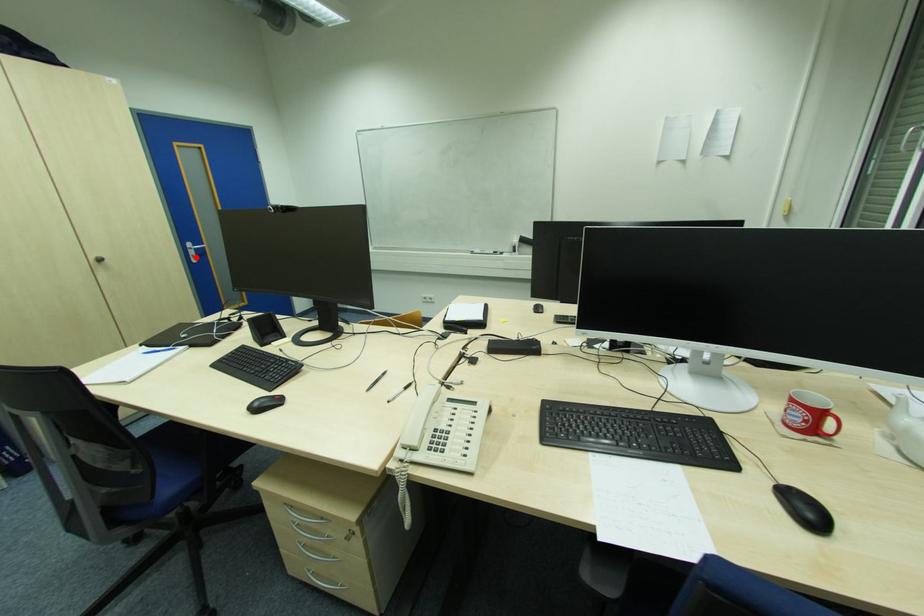
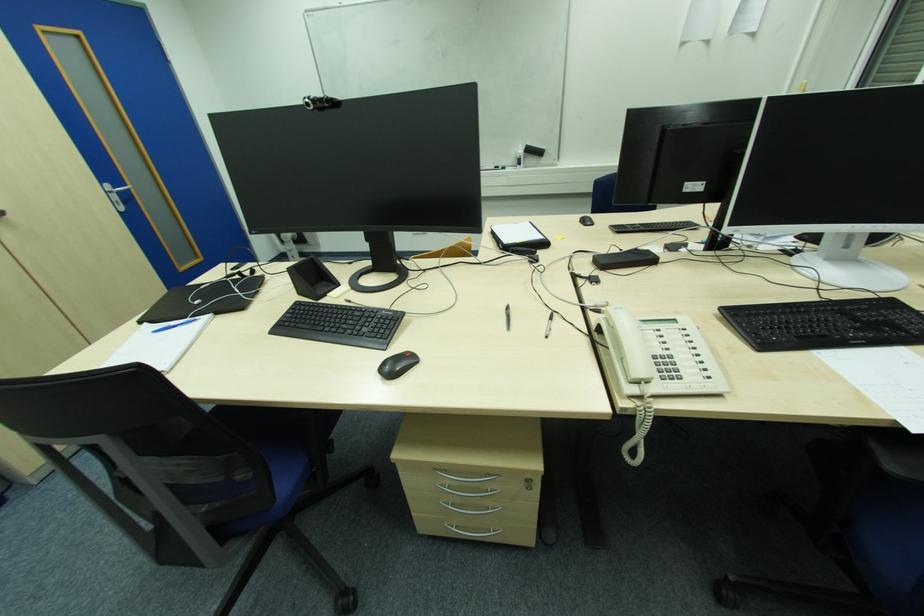
Find the pixel in the second image that matches the highlighted location in the first image.

(119, 204)